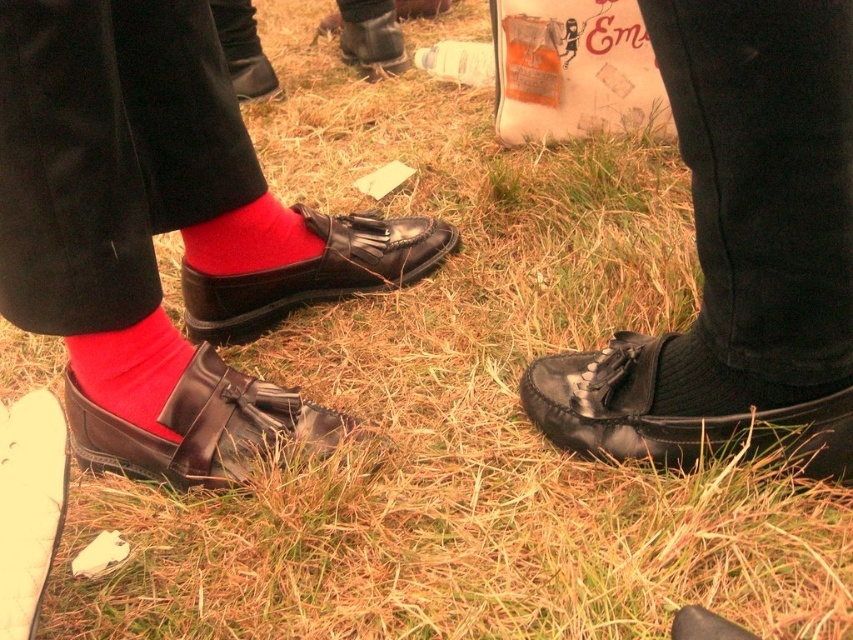
Based on the photo, you are standing in the scene and need to place a small marker exactly at the coordinates given for the matte leather shoes at left. Where should you place it?

You should place the small marker exactly at the coordinates point (163,230) where the matte leather shoes at left is located.

You are a photographer trying to capture a closeup of the shiny black loafer at lower center without including the matte leather shoes at left in the frame. Given their positions, is this possible?

The matte leather shoes at left are to the left of the shiny black loafer at lower center, so if you position the camera to the right side of the shiny black loafer at lower center and frame the shot to exclude the left side, you can capture the shiny black loafer at lower center without including the matte leather shoes at left.

You are standing in a park and see two items on the ground near your feet. The items are the matte leather shoe at left and the matte red sock at left. Which item is positioned more to the right?

The matte leather shoe at left is positioned more to the right than the matte red sock at left.